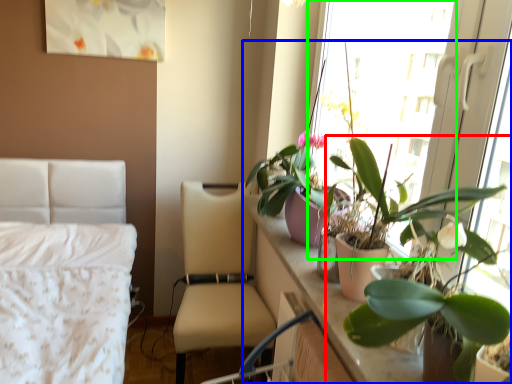
Question: Considering the real-world distances, which object is closest to houseplant (highlighted by a red box)? houseplant (highlighted by a blue box) or window screen (highlighted by a green box).

Choices:
 (A) houseplant
 (B) window screen

Answer: (A)